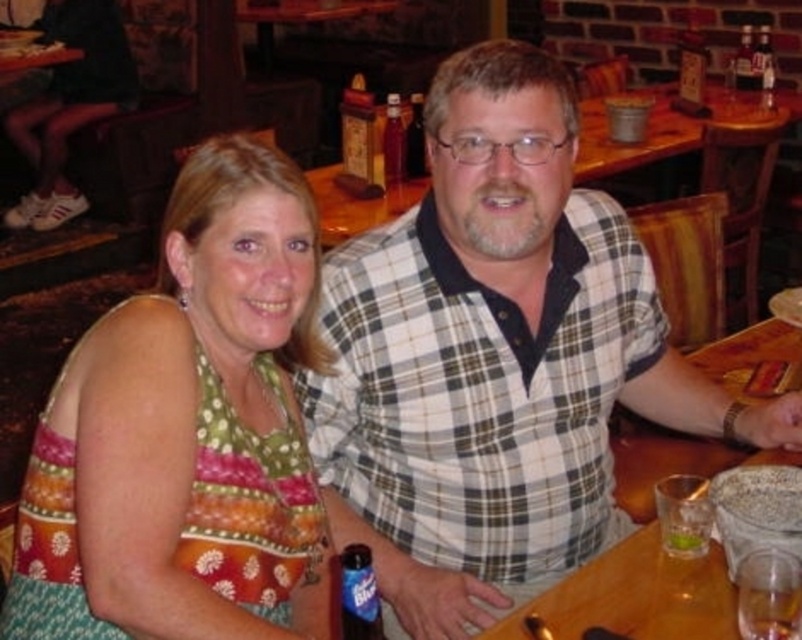
Which is above, white checkered shirt at center or blue plastic bottle at lower center?

Positioned higher is white checkered shirt at center.

Which is more to the right, white checkered shirt at center or blue plastic bottle at lower center?

white checkered shirt at center

Locate an element on the screen. The width and height of the screenshot is (802, 640). white checkered shirt at center is located at coordinates (496, 358).

Locate an element on the screen. The width and height of the screenshot is (802, 640). white checkered shirt at center is located at coordinates (496, 358).

Based on the photo, is white checkered shirt at center smaller than translucent glass bottle at upper right?

No.

Is white checkered shirt at center in front of translucent glass bottle at upper right?

Yes.

Between point (574, 106) and point (691, 22), which one is positioned in front?

Point (574, 106)

Find the location of a particular element. The height and width of the screenshot is (640, 802). white checkered shirt at center is located at coordinates (496, 358).

Is multicolored fabric dress at center to the right of blue plastic bottle at lower center from the viewer's perspective?

In fact, multicolored fabric dress at center is to the left of blue plastic bottle at lower center.

Looking at this image, between multicolored fabric dress at center and blue plastic bottle at lower center, which one is positioned higher?

Positioned higher is multicolored fabric dress at center.

Describe the element at coordinates (184, 426) in the screenshot. I see `multicolored fabric dress at center` at that location.

Find the location of a particular element. The width and height of the screenshot is (802, 640). multicolored fabric dress at center is located at coordinates (184, 426).